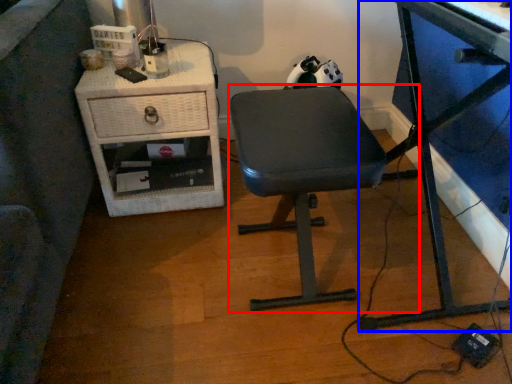
Question: Which object is closer to the camera taking this photo, chair (highlighted by a red box) or desk (highlighted by a blue box)?

Choices:
 (A) chair
 (B) desk

Answer: (B)